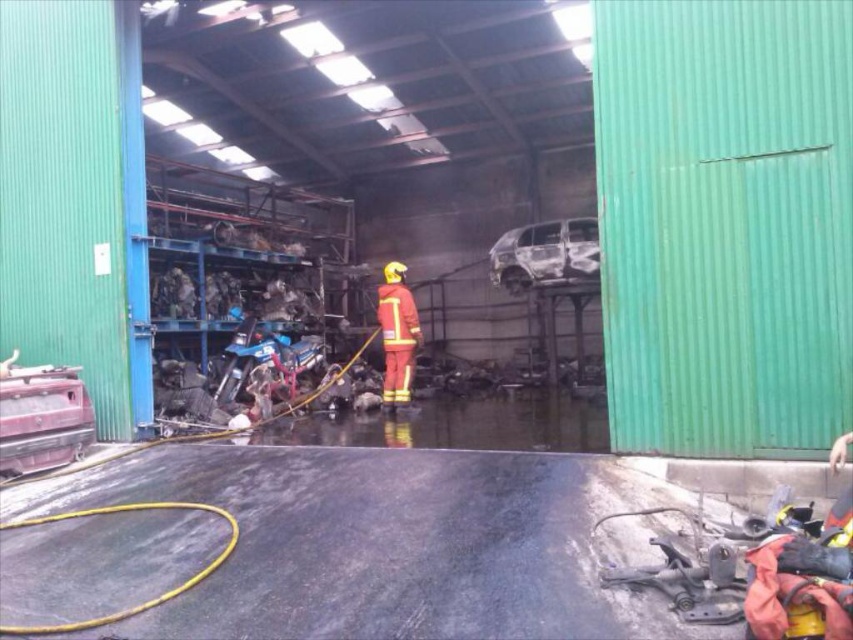
Which is more to the left, burnt metallic car at center or red matte fireman at center?

red matte fireman at center is more to the left.

Can you confirm if burnt metallic car at center is positioned to the left of red matte fireman at center?

Incorrect, burnt metallic car at center is not on the left side of red matte fireman at center.

Is point (579, 241) positioned behind point (383, 342)?

Yes.

You are a GUI agent. You are given a task and a screenshot of the screen. Output one action in this format:
    pyautogui.click(x=<x>, y=<y>)
    Task: Click on the burnt metallic car at center
    The height and width of the screenshot is (640, 853).
    Given the screenshot: What is the action you would take?
    pyautogui.click(x=544, y=253)